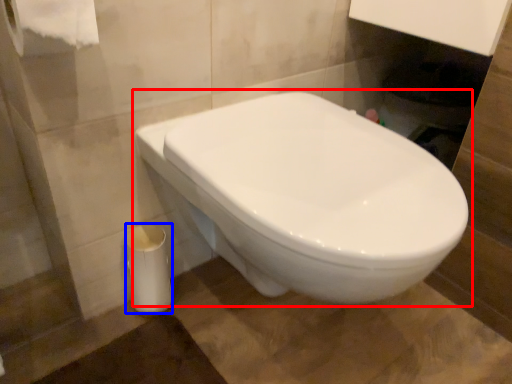
Question: Which point is further to the camera, toilet (highlighted by a red box) or porcelain (highlighted by a blue box)?

Choices:
 (A) toilet
 (B) porcelain

Answer: (B)